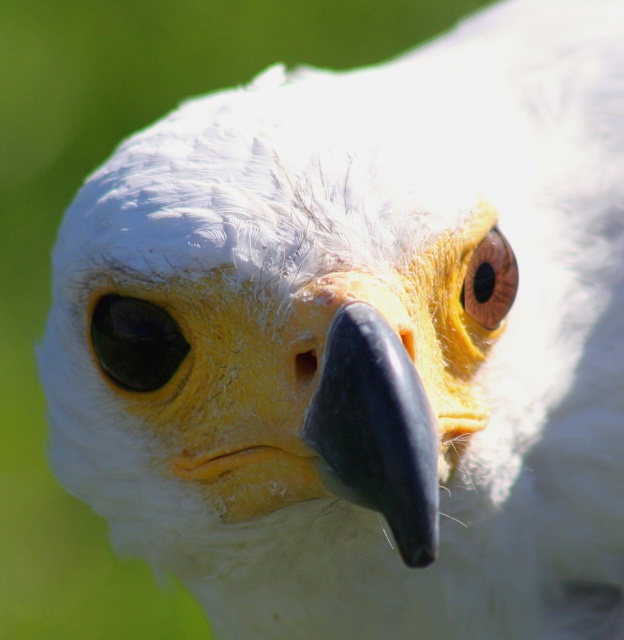
Question: Which of the following is the closest to the observer?

Choices:
 (A) shiny black eye at center
 (B) brown glossy eye at upper center

Answer: (A)

Question: Is shiny black eye at center above brown glossy eye at upper center?

Choices:
 (A) yes
 (B) no

Answer: (B)

Question: Among these points, which one is nearest to the camera?

Choices:
 (A) (475, 260)
 (B) (154, 307)

Answer: (B)

Question: In this image, where is shiny black eye at center located relative to brown glossy eye at upper center?

Choices:
 (A) left
 (B) right

Answer: (A)

Question: Can you confirm if shiny black eye at center is positioned above brown glossy eye at upper center?

Choices:
 (A) yes
 (B) no

Answer: (B)